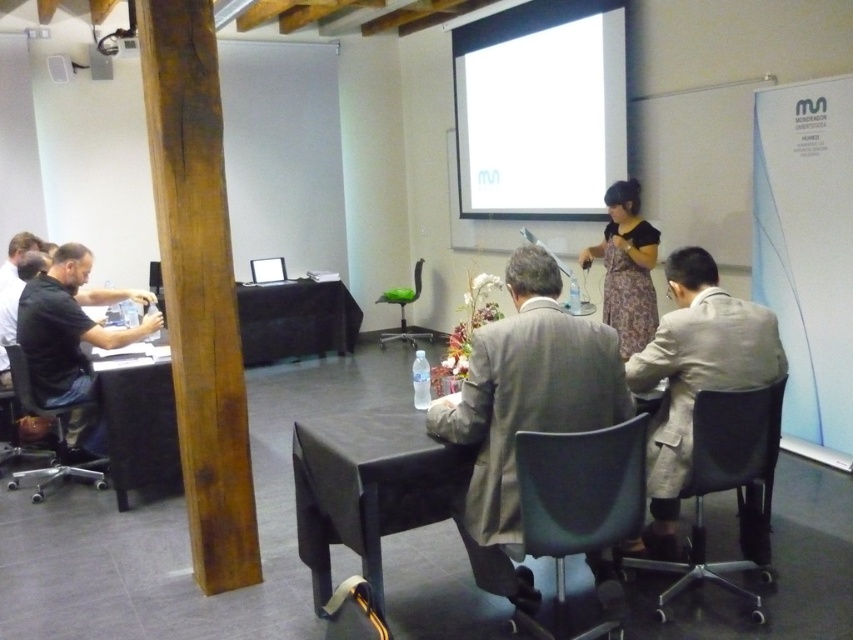
Is white matte projection screen at upper center bigger than light beige suit at right?

Indeed, white matte projection screen at upper center has a larger size compared to light beige suit at right.

Does point (543, 72) come in front of point (693, 355)?

No, (543, 72) is behind (693, 355).

The height and width of the screenshot is (640, 853). I want to click on white matte projection screen at upper center, so click(540, 109).

Measure the distance between light brown suit at center and black matte table at left.

light brown suit at center and black matte table at left are 15.60 feet apart.

Is light brown suit at center to the left of black matte table at left from the viewer's perspective?

In fact, light brown suit at center is to the right of black matte table at left.

Find the location of a particular element. light brown suit at center is located at coordinates (524, 410).

Is black matte table at left to the right of black plastic chair at left from the viewer's perspective?

Correct, you'll find black matte table at left to the right of black plastic chair at left.

Is black matte table at left positioned in front of black plastic chair at left?

No.

Locate an element on the screen. This screenshot has width=853, height=640. black matte table at left is located at coordinates (294, 321).